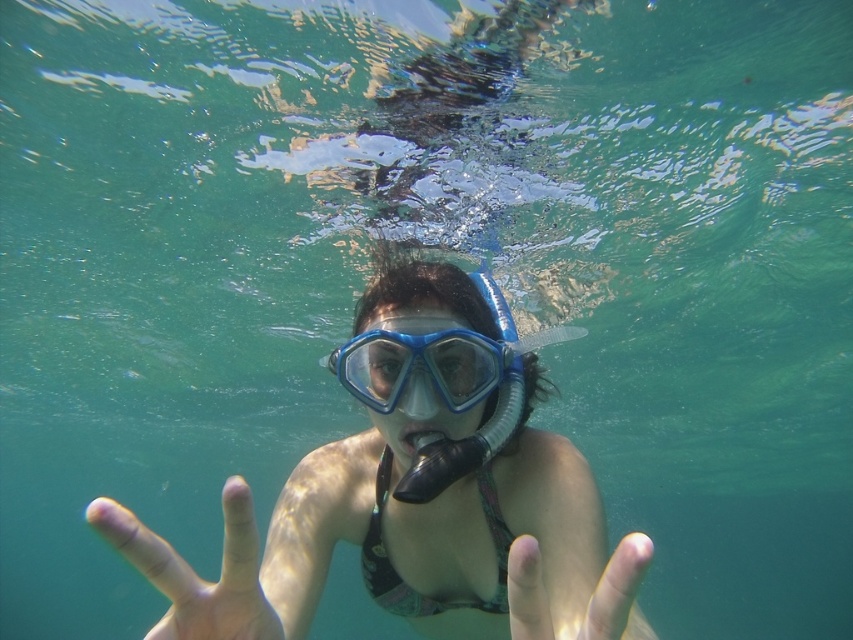
Is transparent blue snorkel mask at center to the right of smooth skin hand at center from the viewer's perspective?

In fact, transparent blue snorkel mask at center is to the left of smooth skin hand at center.

Who is shorter, transparent blue snorkel mask at center or smooth skin hand at center?

Standing shorter between the two is smooth skin hand at center.

Is point (500, 371) farther from camera compared to point (532, 582)?

Yes, point (500, 371) is farther from viewer.

Identify the location of transparent blue snorkel mask at center. This screenshot has width=853, height=640. (410, 502).

Based on the photo, can you confirm if smooth skin hand at center is positioned above blue matte snorkel mask at center?

Incorrect, smooth skin hand at center is not positioned above blue matte snorkel mask at center.

Can you confirm if smooth skin hand at center is bigger than blue matte snorkel mask at center?

Correct, smooth skin hand at center is larger in size than blue matte snorkel mask at center.

Between point (570, 580) and point (434, 378), which one is positioned behind?

Positioned behind is point (434, 378).

At what (x,y) coordinates should I click in order to perform the action: click on smooth skin hand at center. Please return your answer as a coordinate pair (x, y). Looking at the image, I should click on (576, 588).

Which is more to the left, transparent blue snorkel mask at center or blue matte snorkel mask at center?

Result: From the viewer's perspective, transparent blue snorkel mask at center appears more on the left side.

Is point (614, 568) closer to camera compared to point (370, 381)?

Yes, it is.

This screenshot has width=853, height=640. I want to click on transparent blue snorkel mask at center, so click(x=410, y=502).